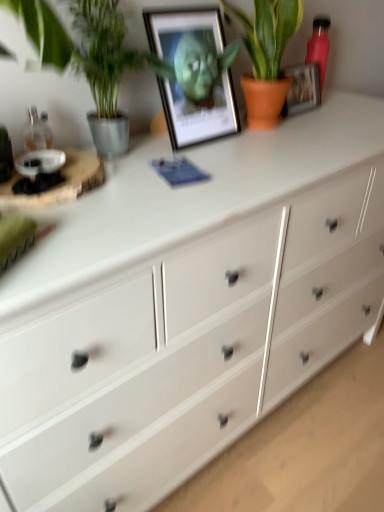
Question: Which direction should I rotate to face terracotta pot plant at upper center, which is counted as the 1th houseplant, starting from the right, — up or down?

Choices:
 (A) up
 (B) down

Answer: (A)

Question: Does green leafy plant at left, which is the second houseplant in right-to-left order, have a lesser width compared to metallic framed picture at upper center?

Choices:
 (A) yes
 (B) no

Answer: (B)

Question: Would you say green leafy plant at left, which is the second houseplant in right-to-left order, contains metallic framed picture at upper center?

Choices:
 (A) no
 (B) yes

Answer: (A)

Question: Is green leafy plant at left, which is counted as the first houseplant, starting from the left, beside metallic framed picture at upper center?

Choices:
 (A) yes
 (B) no

Answer: (B)

Question: Is green leafy plant at left, which is counted as the first houseplant, starting from the left, smaller than metallic framed picture at upper center?

Choices:
 (A) yes
 (B) no

Answer: (A)

Question: Is green leafy plant at left, which is the second houseplant in right-to-left order, positioned far away from metallic framed picture at upper center?

Choices:
 (A) yes
 (B) no

Answer: (B)

Question: From the image's perspective, is green leafy plant at left, which is counted as the first houseplant, starting from the left, below metallic framed picture at upper center?

Choices:
 (A) no
 (B) yes

Answer: (B)

Question: Is metallic framed picture at upper center facing away from pink matte bottle at upper right?

Choices:
 (A) no
 (B) yes

Answer: (A)

Question: Is pink matte bottle at upper right completely or partially inside metallic framed picture at upper center?

Choices:
 (A) no
 (B) yes

Answer: (A)

Question: Would you say metallic framed picture at upper center is outside pink matte bottle at upper right?

Choices:
 (A) yes
 (B) no

Answer: (A)

Question: Is metallic framed picture at upper center shorter than pink matte bottle at upper right?

Choices:
 (A) yes
 (B) no

Answer: (B)

Question: From a real-world perspective, is metallic framed picture at upper center below pink matte bottle at upper right?

Choices:
 (A) yes
 (B) no

Answer: (B)

Question: Considering the relative positions of metallic framed picture at upper center and pink matte bottle at upper right in the image provided, is metallic framed picture at upper center in front of pink matte bottle at upper right?

Choices:
 (A) no
 (B) yes

Answer: (B)

Question: Is metallic framed picture at upper center not close to green leafy plant at left, which is counted as the first houseplant, starting from the left?

Choices:
 (A) no
 (B) yes

Answer: (A)